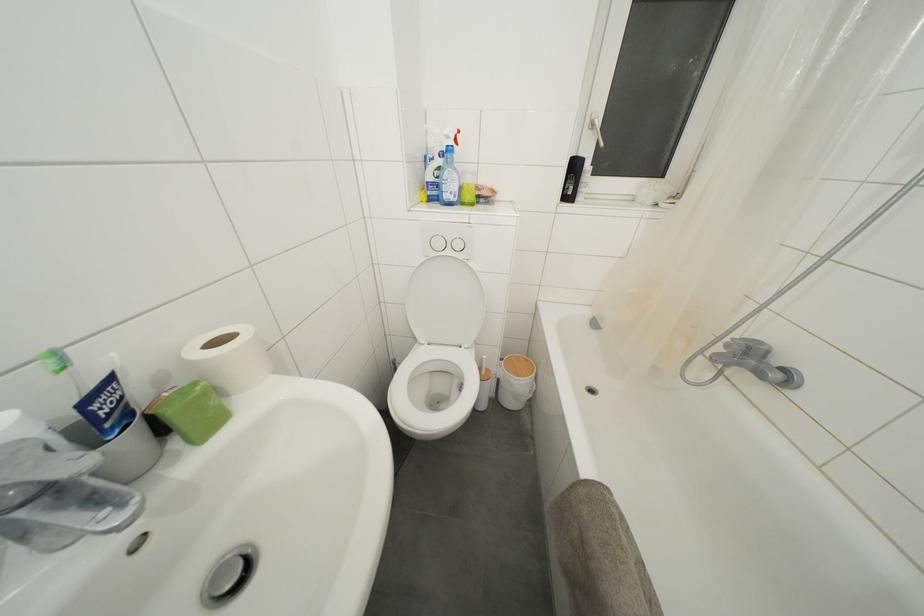
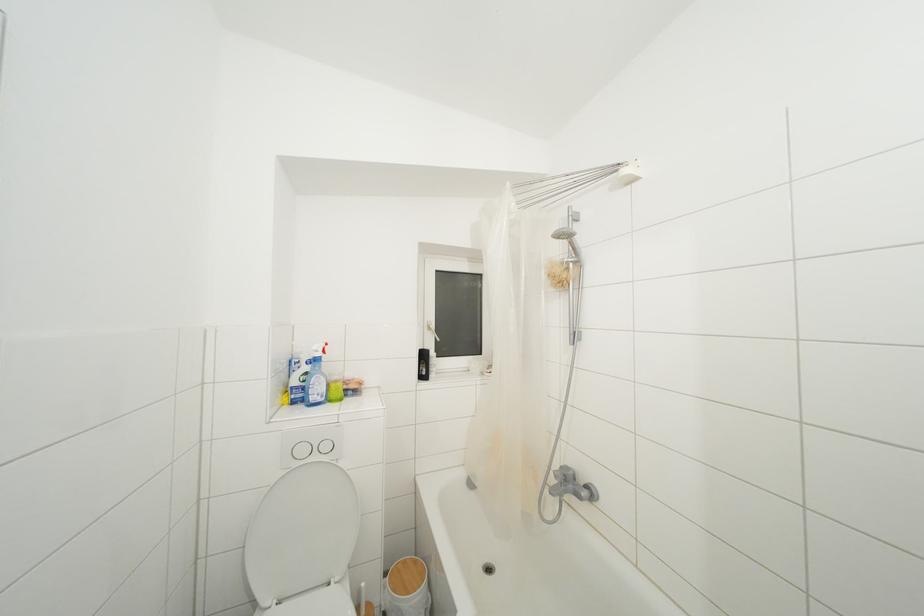
Find the pixel in the second image that matches [492,375] in the first image.

(371, 610)